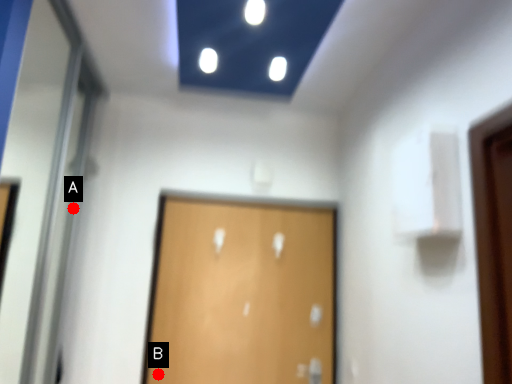
Question: Two points are circled on the image, labeled by A and B beside each circle. Which of the following is the closest to the observer?

Choices:
 (A) A is closer
 (B) B is closer

Answer: (B)